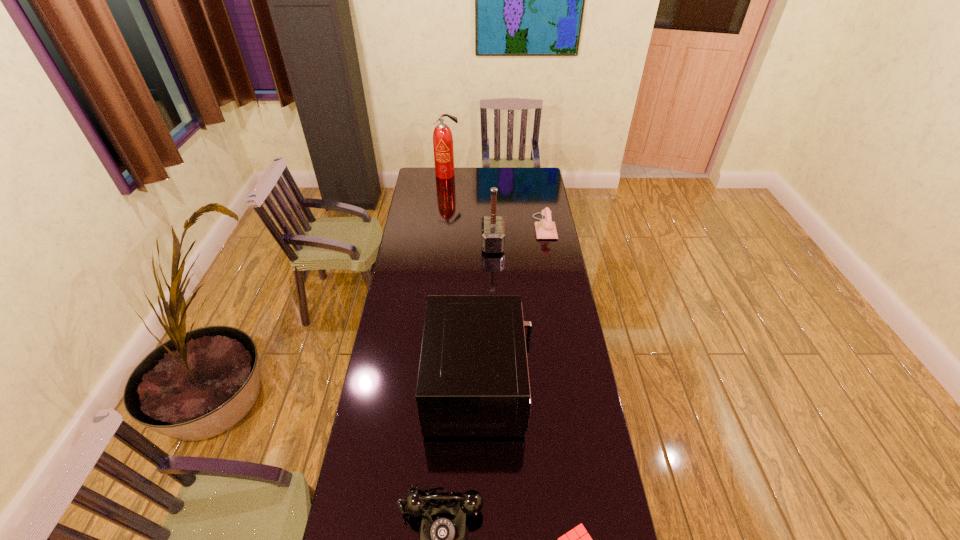
The image size is (960, 540). I want to click on vacant space situated on the dial of the farther telephone, so click(521, 227).

You are a GUI agent. You are given a task and a screenshot of the screen. Output one action in this format:
    pyautogui.click(x=<x>, y=<y>)
    Task: Click on the object located at the far edge
    The width and height of the screenshot is (960, 540).
    Given the screenshot: What is the action you would take?
    pyautogui.click(x=442, y=136)

This screenshot has height=540, width=960. I want to click on object that is at the left edge, so click(x=442, y=136).

At what (x,y) coordinates should I click in order to perform the action: click on object located at the right edge. Please return your answer as a coordinate pair (x, y). Looking at the image, I should click on (545, 229).

At what (x,y) coordinates should I click in order to perform the action: click on object that is at the far left corner. Please return your answer as a coordinate pair (x, y). The height and width of the screenshot is (540, 960). Looking at the image, I should click on (442, 136).

Where is `free region at the far edge of the desktop`? free region at the far edge of the desktop is located at coordinates (448, 183).

In the image, there is a desktop. Where is `vacant area at the left edge`? vacant area at the left edge is located at coordinates (400, 279).

Where is `free space at the right edge of the desktop`? The image size is (960, 540). free space at the right edge of the desktop is located at coordinates (561, 296).

This screenshot has width=960, height=540. I want to click on free region at the far right corner of the desktop, so click(543, 171).

This screenshot has width=960, height=540. Find the location of `free space between the farther telephone and the fifth shortest object`. free space between the farther telephone and the fifth shortest object is located at coordinates pos(518,235).